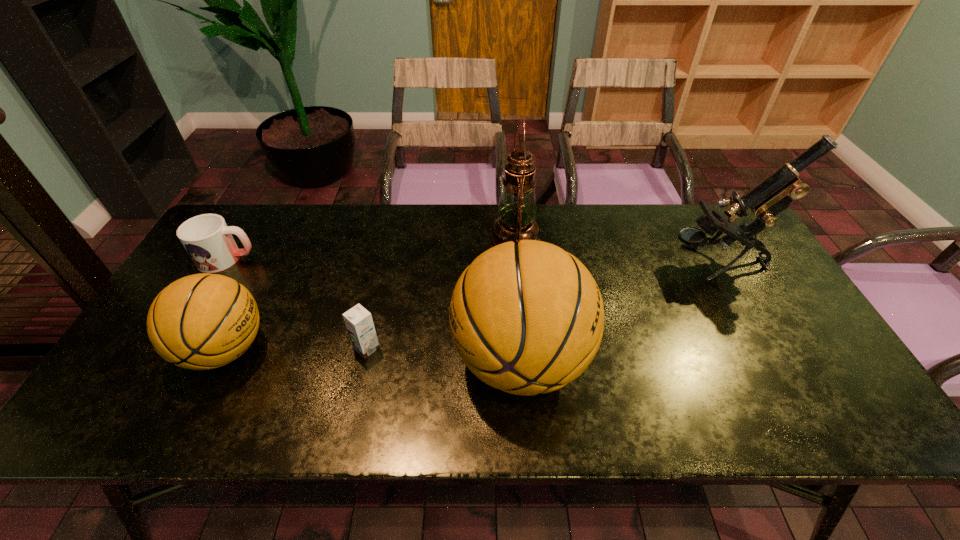
The image size is (960, 540). In order to click on vacant space located on the surface of the fourth shortest object near the brand logo in this screenshot , I will do `click(423, 360)`.

Find the location of a particular element. vacant space located 0.120m on the surface of the fourth shortest object near the brand logo is located at coordinates coord(403,360).

This screenshot has height=540, width=960. In order to click on free location located 0.110m on the right of the oil lamp in this screenshot , I will do `click(575, 241)`.

Where is `vacant space located on the side of the mug with the handle`? The height and width of the screenshot is (540, 960). vacant space located on the side of the mug with the handle is located at coordinates (282, 259).

Where is `vacant space positioned on the left of the fourth object from right to left`? vacant space positioned on the left of the fourth object from right to left is located at coordinates (241, 348).

I want to click on vacant point located through the eyepiece of the microscope, so click(558, 262).

I want to click on free point located through the eyepiece of the microscope, so (645, 262).

Find the location of a particular element. The height and width of the screenshot is (540, 960). vacant region located 0.260m through the eyepiece of the microscope is located at coordinates (581, 262).

I want to click on oil lamp located in the far edge section of the desktop, so click(x=516, y=210).

This screenshot has width=960, height=540. I want to click on mug that is at the far edge, so click(x=208, y=240).